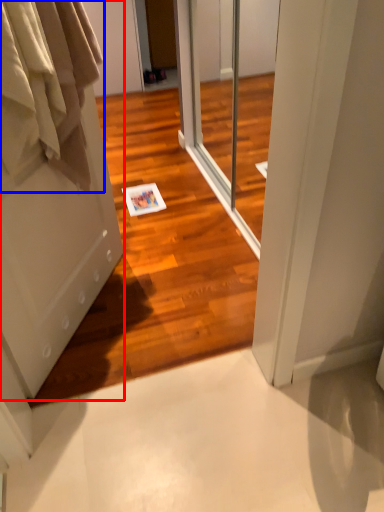
Question: Which of the following is the farthest to the observer, door (highlighted by a red box) or clothing (highlighted by a blue box)?

Choices:
 (A) door
 (B) clothing

Answer: (B)